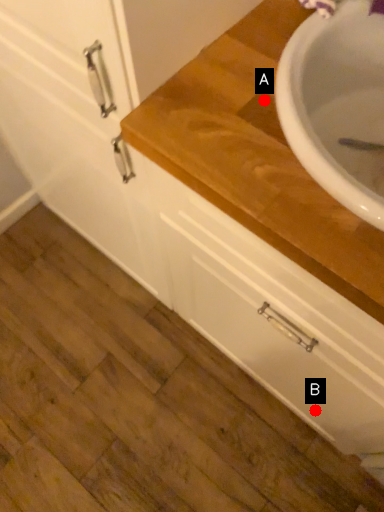
Question: Two points are circled on the image, labeled by A and B beside each circle. Which point is farther to the camera?

Choices:
 (A) A is further
 (B) B is further

Answer: (B)